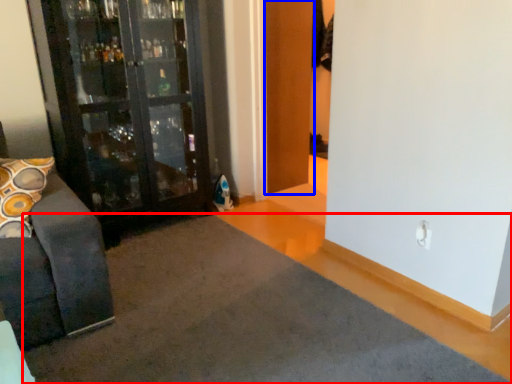
Question: Which object appears closest to the camera in this image, doormat (highlighted by a red box) or door (highlighted by a blue box)?

Choices:
 (A) doormat
 (B) door

Answer: (A)